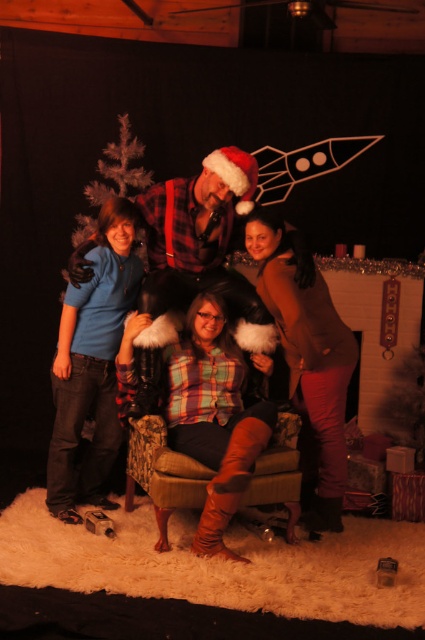
Question: Can you confirm if plaid flannel shirt at center is positioned above brown matte sweater at upper right?

Choices:
 (A) yes
 (B) no

Answer: (A)

Question: Does plaid flannel shirt at center appear on the left side of white feathered christmas tree at left?

Choices:
 (A) yes
 (B) no

Answer: (B)

Question: Which object is closer to the camera taking this photo?

Choices:
 (A) plaid flannel shirt at center
 (B) brown matte sweater at upper right

Answer: (A)

Question: Can you confirm if matte blue shirt at left is positioned below white feathered christmas tree at left?

Choices:
 (A) no
 (B) yes

Answer: (B)

Question: Which point is farther from the camera taking this photo?

Choices:
 (A) (130, 161)
 (B) (292, 356)
 (C) (257, 362)
 (D) (59, 337)

Answer: (A)

Question: Which point is farther from the camera taking this photo?

Choices:
 (A) (116, 232)
 (B) (90, 230)
 (C) (59, 353)

Answer: (B)